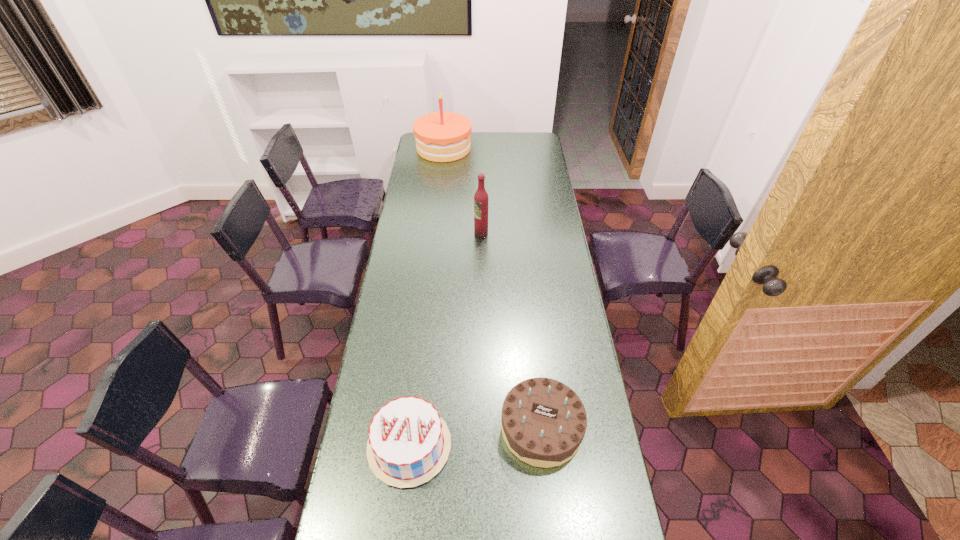
Locate an element on the screen. This screenshot has width=960, height=540. object located at the far edge is located at coordinates (441, 136).

Where is `object positioned at the right edge`? object positioned at the right edge is located at coordinates (543, 422).

Locate an element on the screen. object at the far left corner is located at coordinates click(x=441, y=136).

Locate an element on the screen. free space at the far edge of the desktop is located at coordinates (479, 152).

Identify the location of vacant space at the left edge. The width and height of the screenshot is (960, 540). (419, 316).

The height and width of the screenshot is (540, 960). I want to click on free location at the right edge of the desktop, so click(x=542, y=153).

Where is `free space at the far right corner`? This screenshot has height=540, width=960. free space at the far right corner is located at coordinates pos(535,143).

Identify the location of unoccupied position between the rightmost birthday cake and the liquor. (512, 330).

The width and height of the screenshot is (960, 540). Identify the location of free spot between the second object from right to left and the farthest object. (463, 191).

Choose which object is the nearest neighbor to the second object from right to left. Please provide its 2D coordinates. Your answer should be formatted as a tuple, i.e. [(x, y)], where the tuple contains the x and y coordinates of a point satisfying the conditions above.

[(441, 136)]